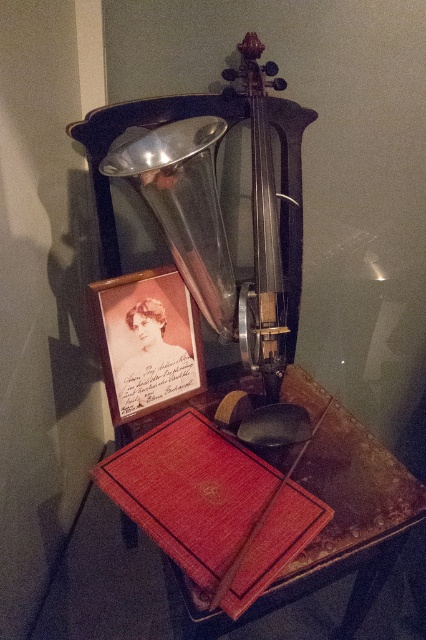
You are organizing a display for an antique shop and need to place the red leather book at lower center and the red leather book at center on a shelf. The shelf has limited space, and you want to ensure the wider book is placed first. Which book should you place first on the shelf?

The red leather book at lower center should be placed first because its width is larger than the red leather book at center, ensuring the wider book is accommodated first on the shelf.

You are organizing a museum exhibit and need to place a decorative vase between the red leather book at lower center and the red leather book at center. Based on their positions, where should you place the vase?

The vase should be placed between the red leather book at lower center and the red leather book at center, as the red leather book at lower center is positioned below the other book. However, since the books are vertically aligned, the vase might need to be placed in a way that accounts for their vertical spacing.

You are a historian examining the vintage phonograph and its surrounding items. You need to locate the red leather book at lower center. According to the coordinates provided, where exactly is the red leather book positioned relative to the phonograph?

The red leather book at lower center is positioned at coordinates point (347, 506) relative to the phonograph.